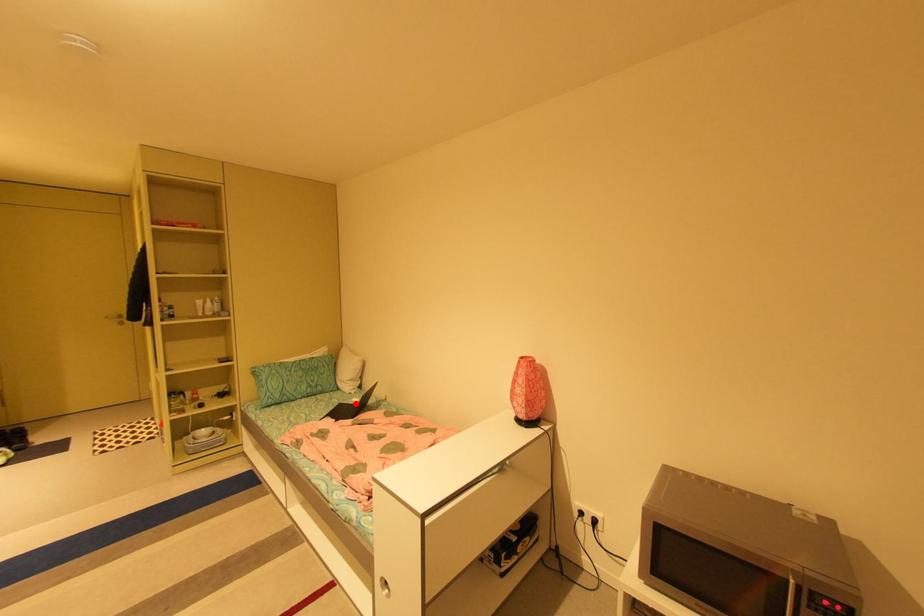
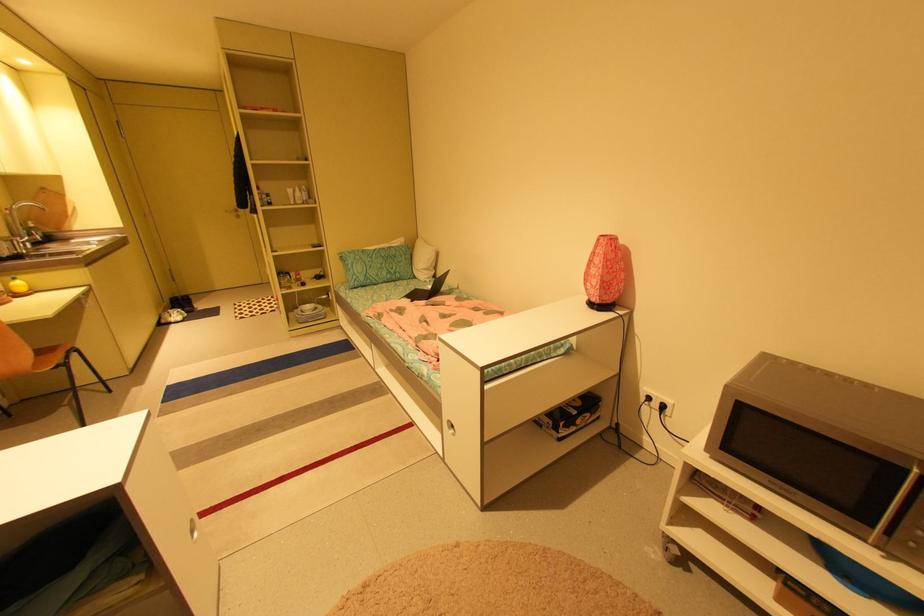
Find the pixel in the second image that matches the highlighted location in the first image.

(431, 290)